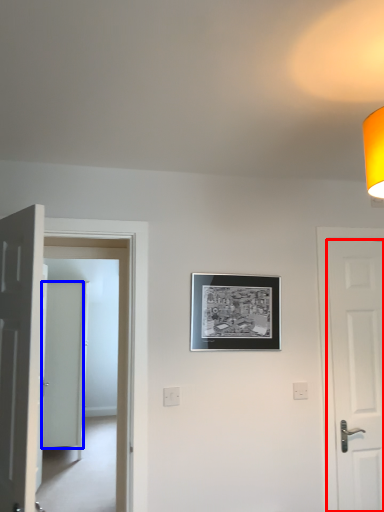
Question: Which of the following is the closest to the observer, door (highlighted by a red box) or door (highlighted by a blue box)?

Choices:
 (A) door
 (B) door

Answer: (A)